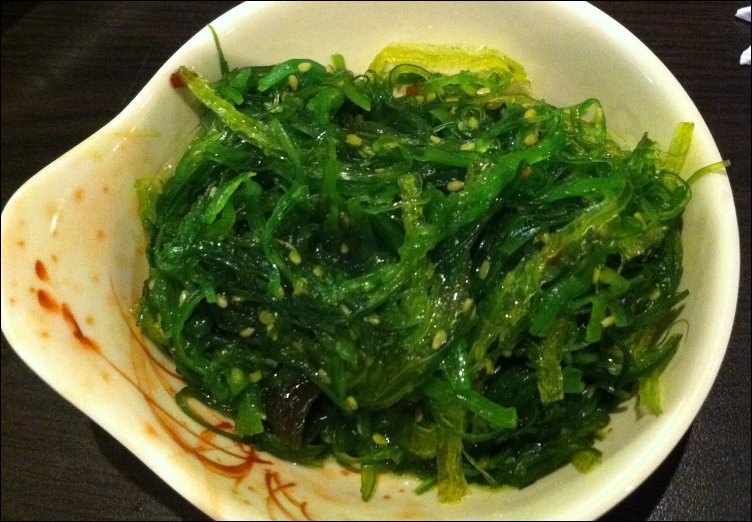
Image resolution: width=752 pixels, height=522 pixels. In order to click on pouring spout on left side of bowl in this screenshot , I will do `click(59, 241)`, `click(55, 260)`, `click(56, 315)`.